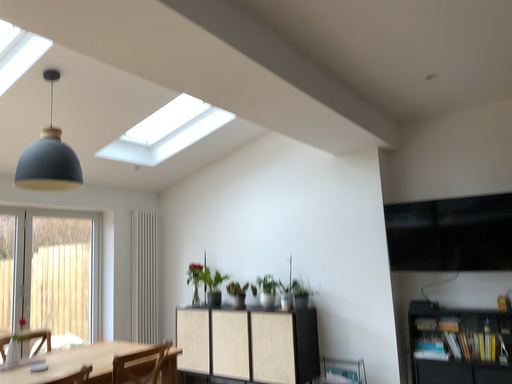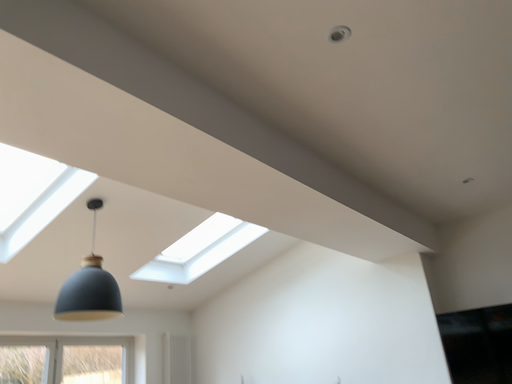
Question: Which way did the camera rotate in the video?

Choices:
 (A) rotated downward
 (B) rotated upward

Answer: (B)